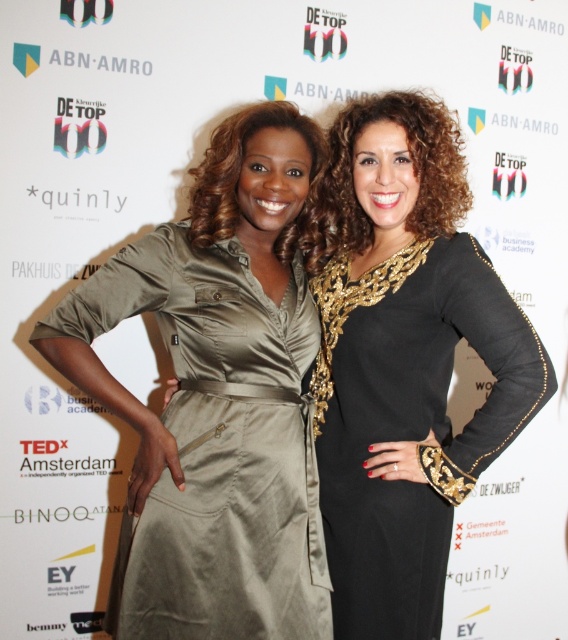
Which is above, satin olive dress at center or black sequined dress at right?

satin olive dress at center is above.

Is point (164, 234) less distant than point (400, 632)?

No, (164, 234) is behind (400, 632).

Measure the distance between point (x=279, y=547) and camera.

Point (x=279, y=547) and camera are 4.31 feet apart.

The image size is (568, 640). What are the coordinates of `satin olive dress at center` in the screenshot? It's located at (216, 445).